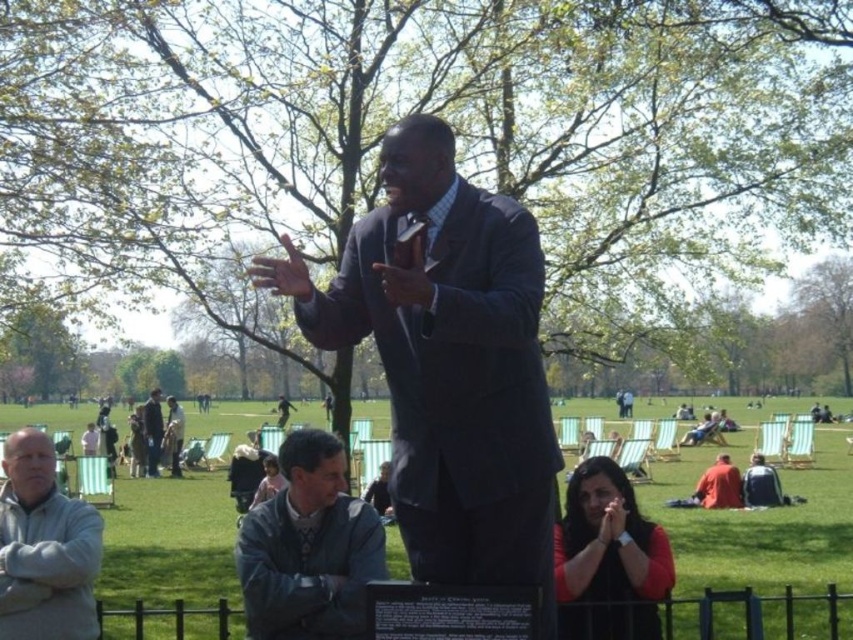
Question: Which object is positioned farthest from the light gray fleece jacket at lower left?

Choices:
 (A) shiny black statue at center
 (B) dark blue suit at center
 (C) dark brown leather jacket at center

Answer: (C)

Question: Where is red cotton shirt at lower right located in relation to dark brown leather jacket at center in the image?

Choices:
 (A) below
 (B) above

Answer: (A)

Question: Which of these objects is positioned closest to the dark brown leather jacket at center?

Choices:
 (A) gray leather jacket at lower center
 (B) red cotton shirt at lower right
 (C) dark blue suit at center
 (D) light gray fleece jacket at lower left

Answer: (B)

Question: In this image, where is gray leather jacket at lower center located relative to red cotton shirt at lower right?

Choices:
 (A) below
 (B) above

Answer: (B)

Question: In this image, where is gray leather jacket at lower center located relative to light gray fleece jacket at lower left?

Choices:
 (A) below
 (B) above

Answer: (A)

Question: Which point is farther to the camera?

Choices:
 (A) dark blue suit at center
 (B) shiny black statue at center

Answer: (B)